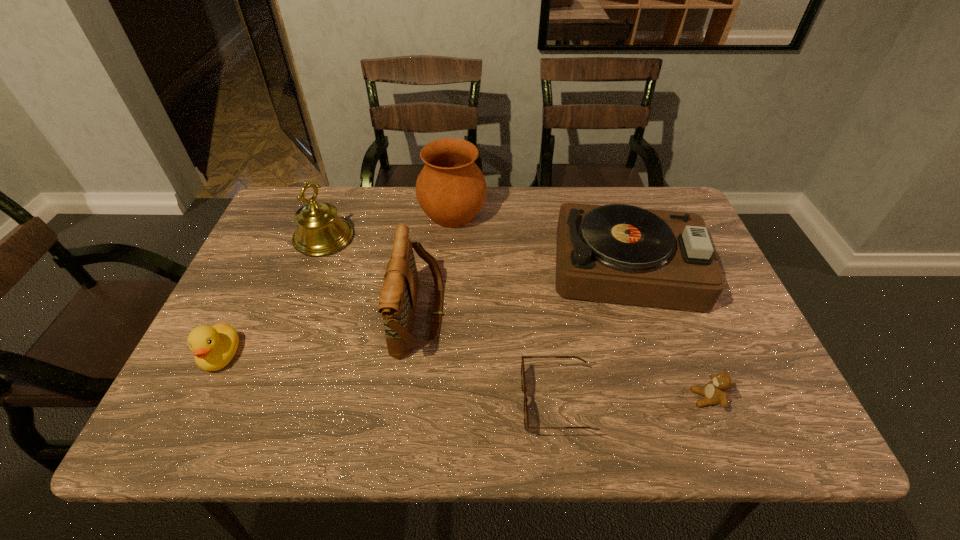
Locate an element on the screen. This screenshot has width=960, height=540. bell that is at the far edge is located at coordinates (320, 231).

What are the coordinates of `record player located in the far edge section of the desktop` in the screenshot? It's located at (618, 253).

The height and width of the screenshot is (540, 960). What are the coordinates of `teddy bear that is at the near edge` in the screenshot? It's located at (715, 392).

At what (x,y) coordinates should I click in order to perform the action: click on spectacles that is at the near edge. Please return your answer as a coordinate pair (x, y). This screenshot has height=540, width=960. Looking at the image, I should click on (526, 420).

Image resolution: width=960 pixels, height=540 pixels. Identify the location of bell that is at the left edge. (320, 231).

What are the coordinates of `duckling that is positioned at the left edge` in the screenshot? It's located at (214, 347).

Identify the location of record player that is at the right edge. The width and height of the screenshot is (960, 540). (618, 253).

I want to click on teddy bear that is at the right edge, so click(715, 392).

Locate an element on the screen. The image size is (960, 540). object at the far left corner is located at coordinates (320, 231).

Find the location of `object present at the far right corner`. object present at the far right corner is located at coordinates [x=618, y=253].